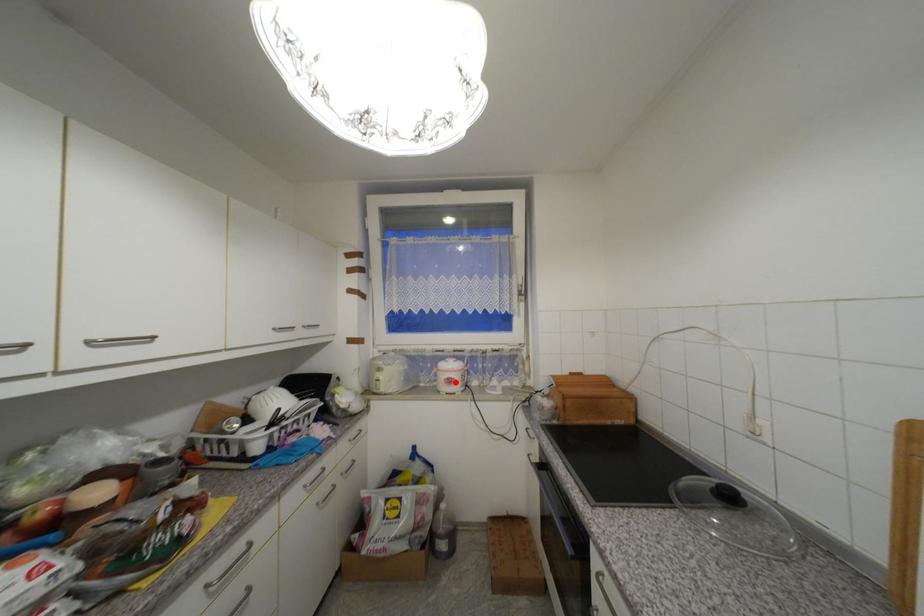
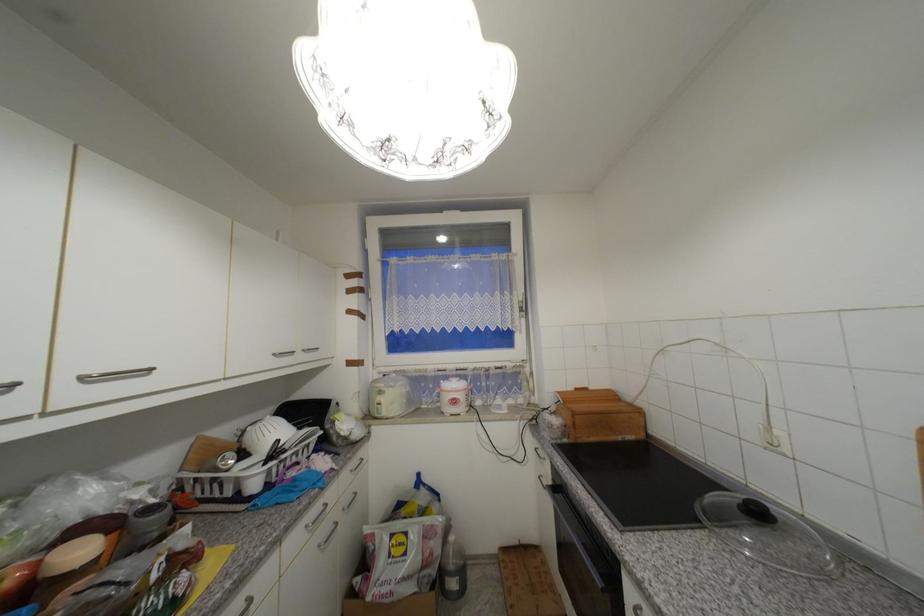
In the second image, find the point that corresponds to the highlighted location in the first image.

(459, 403)